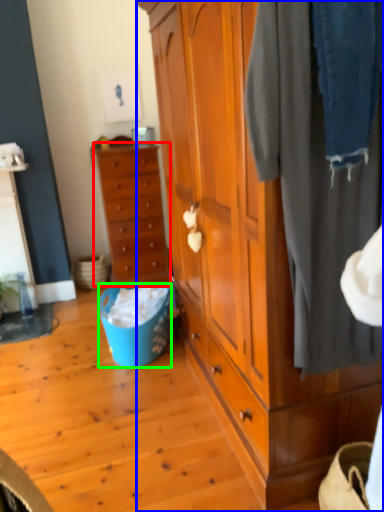
Question: Considering the real-world distances, which object is closest to chest of drawers (highlighted by a red box)? cabinetry (highlighted by a blue box) or picnic basket (highlighted by a green box).

Choices:
 (A) cabinetry
 (B) picnic basket

Answer: (B)